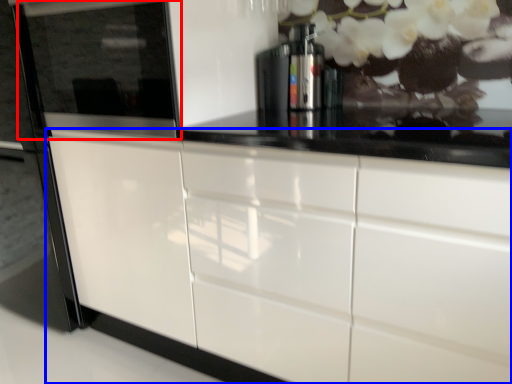
Question: Which of the following is the closest to the observer, appliance (highlighted by a red box) or cabinetry (highlighted by a blue box)?

Choices:
 (A) appliance
 (B) cabinetry

Answer: (B)